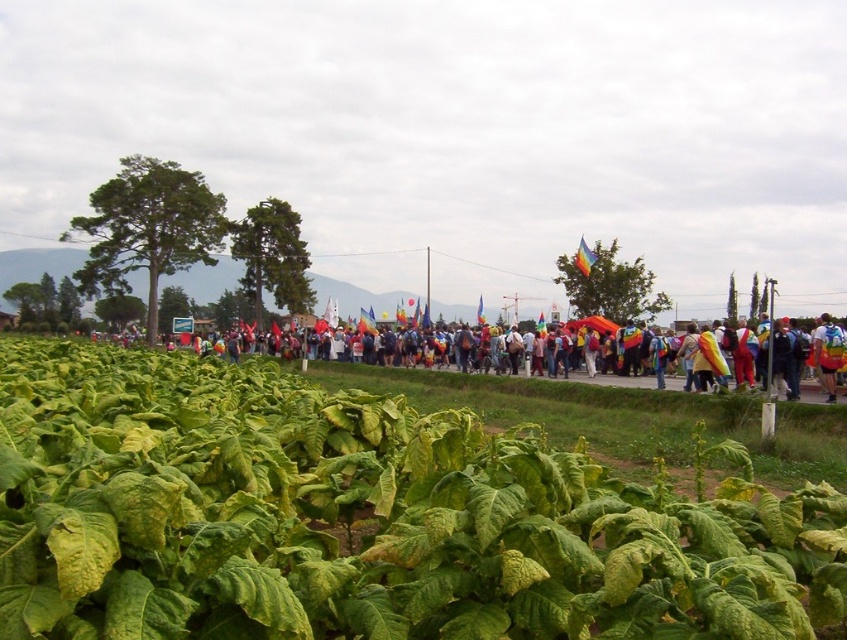
Does green leafy plant at center have a lesser height compared to rainbow flag at center?

Yes, green leafy plant at center is shorter than rainbow flag at center.

Does point (237, 371) lie behind point (580, 321)?

No, it is in front of (580, 321).

Where is `green leafy plant at center`? The image size is (847, 640). green leafy plant at center is located at coordinates (364, 518).